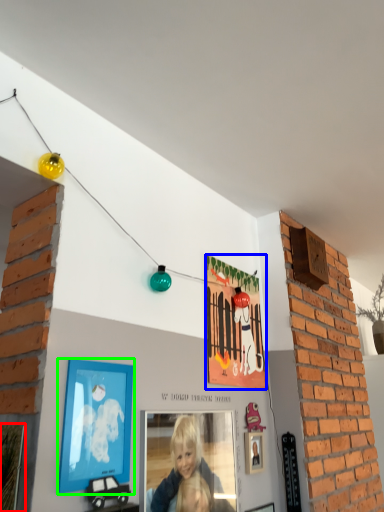
Question: Estimate the real-world distances between objects in this image. Which object is closer to picture frame (highlighted by a red box), picture frame (highlighted by a blue box) or picture frame (highlighted by a green box)?

Choices:
 (A) picture frame
 (B) picture frame

Answer: (B)